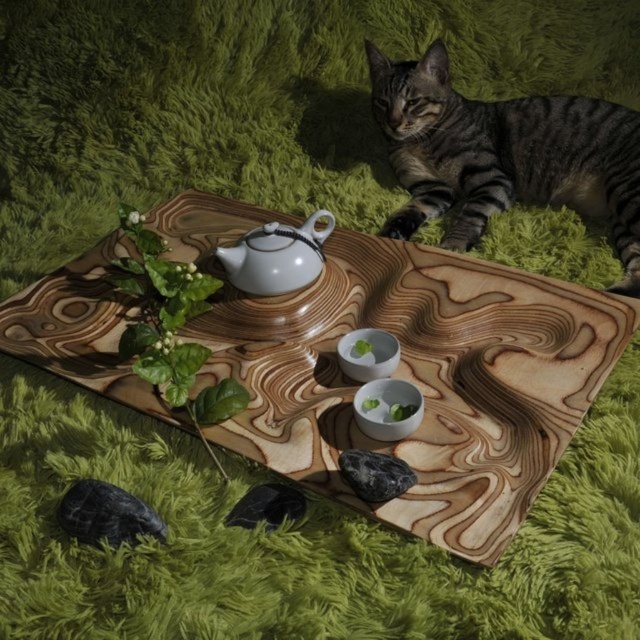
You are setting up a tea service and need to place the white glossy bowls at center on the wooden tray at center. Can you fit them without overlapping the edges of the tray?

The wooden tray at center is bigger than the white glossy bowls at center, so yes, you can fit them without overlapping the edges of the tray.

You are standing in front of the wooden tray with intricate patterns. There are two points marked on the tray at coordinates point (605,113) and point (396,419). Which point is closer to you?

Point (605,113) is further to the viewer than point (396,419), so point (396,419) is closer to you.

You are a photographer setting up a shot of the tabby fur cat at upper right and the white glossy bowls at center. To ensure both are in frame, should you adjust your camera to the left or right?

The tabby fur cat at upper right is to the right of the white glossy bowls at center, so you should adjust your camera to the right to ensure both are in frame.